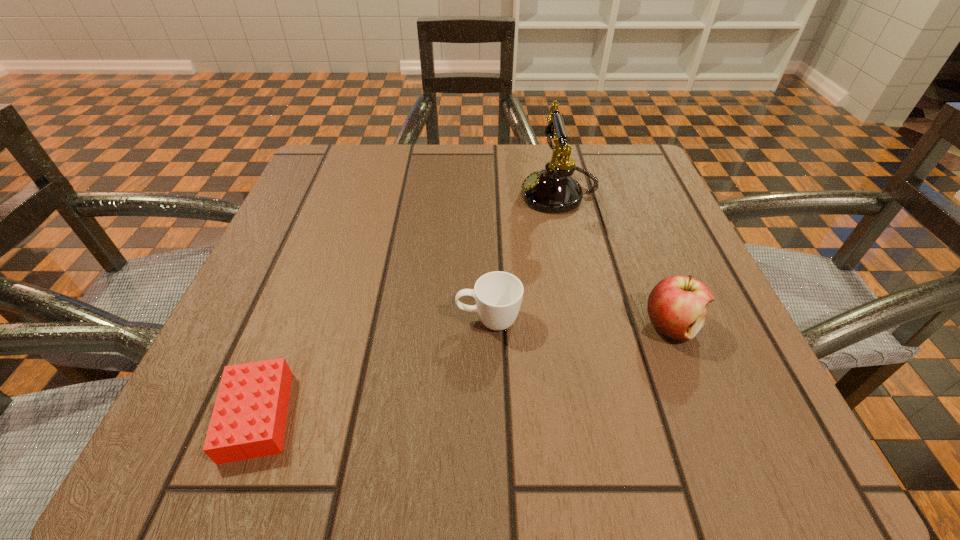
Where is `the tallest object`? Image resolution: width=960 pixels, height=540 pixels. the tallest object is located at coordinates (552, 190).

Where is `telephone`? telephone is located at coordinates (552, 190).

Where is `apple`? This screenshot has height=540, width=960. apple is located at coordinates (676, 306).

In order to click on the third shortest object in this screenshot , I will do `click(676, 306)`.

The height and width of the screenshot is (540, 960). I want to click on the second shortest object, so click(498, 295).

Find the location of a particular element. the second object from left to right is located at coordinates (498, 295).

Find the location of a particular element. The width and height of the screenshot is (960, 540). the leftmost object is located at coordinates pyautogui.click(x=248, y=421).

I want to click on the nearest object, so click(x=248, y=421).

At what (x,y) coordinates should I click in order to perform the action: click on vacant area situated 0.070m on the dial of the farthest object. Please return your answer as a coordinate pair (x, y). The width and height of the screenshot is (960, 540). Looking at the image, I should click on (487, 194).

What are the coordinates of `blank area located 0.360m on the dial of the farthest object` in the screenshot? It's located at (344, 194).